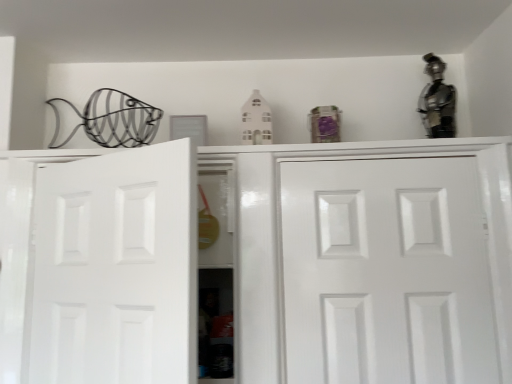
Question: Is white glossy door at center, the 1th door when ordered from right to left, wider or thinner than metallic silver figurine at upper right?

Choices:
 (A) wide
 (B) thin

Answer: (B)

Question: From the image's perspective, relative to metallic silver figurine at upper right, is white glossy door at center, the 2th door in the left-to-right sequence, above or below?

Choices:
 (A) below
 (B) above

Answer: (A)

Question: Estimate the real-world distances between objects in this image. Which object is farther from the white matte door at left, the 2th door positioned from the right?

Choices:
 (A) white glossy door at center, the 1th door when ordered from right to left
 (B) metallic silver figurine at upper right
 (C) white glossy cabinet doors at center

Answer: (B)

Question: Which object is positioned closest to the metallic silver figurine at upper right?

Choices:
 (A) white matte door at left, arranged as the first door when viewed from the left
 (B) white glossy cabinet doors at center
 (C) white glossy door at center, the 2th door in the left-to-right sequence

Answer: (B)